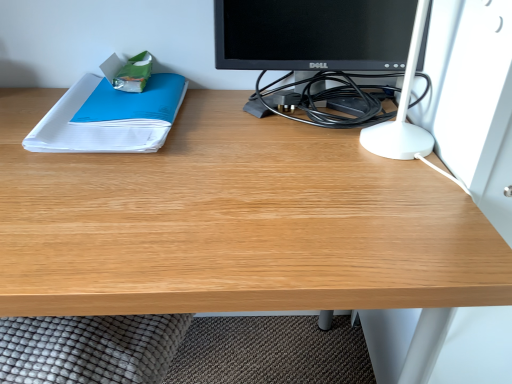
This screenshot has height=384, width=512. I want to click on vacant area on top of white paper at left (from a real-world perspective), so click(112, 102).